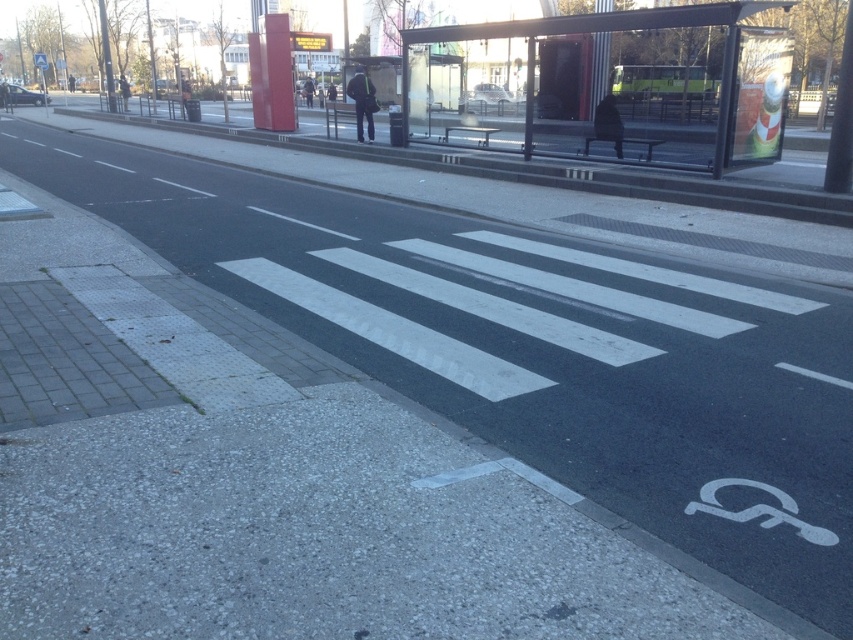
Is dark blue jacket at center to the left of black leather jacket at upper center from the viewer's perspective?

In fact, dark blue jacket at center is to the right of black leather jacket at upper center.

Does point (357, 122) come closer to viewer compared to point (125, 92)?

Yes, it is in front of point (125, 92).

Is point (370, 128) behind point (126, 104)?

No, (370, 128) is in front of (126, 104).

Where is `dark blue jacket at center`? This screenshot has height=640, width=853. dark blue jacket at center is located at coordinates (363, 100).

Which is in front, point (341, 156) or point (126, 99)?

Positioned in front is point (341, 156).

Locate an element on the screen. gray concrete curb at center is located at coordinates (537, 172).

This screenshot has height=640, width=853. I want to click on gray concrete curb at center, so click(x=537, y=172).

Between transparent glass bus stop at upper center and black fabric jacket at center, which one appears on the left side from the viewer's perspective?

From the viewer's perspective, black fabric jacket at center appears more on the left side.

Between transparent glass bus stop at upper center and black fabric jacket at center, which one appears on the right side from the viewer's perspective?

Positioned to the right is transparent glass bus stop at upper center.

What do you see at coordinates (595, 33) in the screenshot?
I see `transparent glass bus stop at upper center` at bounding box center [595, 33].

This screenshot has height=640, width=853. What are the coordinates of `transparent glass bus stop at upper center` in the screenshot? It's located at (595, 33).